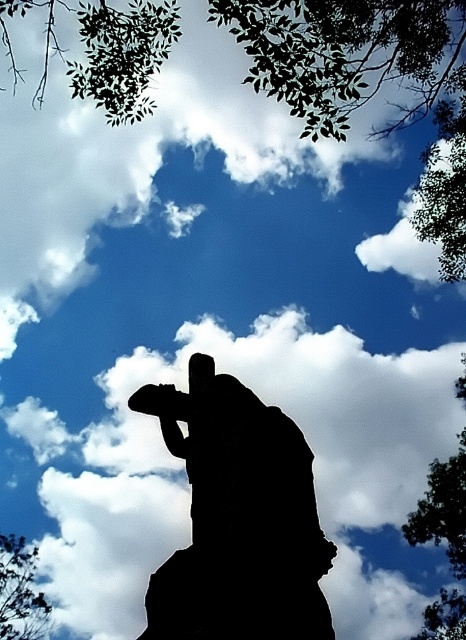
Question: Can you confirm if black silhouette skateboarder at center is wider than green leafy tree at upper left?

Choices:
 (A) no
 (B) yes

Answer: (B)

Question: Which object appears farthest from the camera in this image?

Choices:
 (A) black silhouette skateboarder at center
 (B) green leafy tree at upper left

Answer: (B)

Question: Considering the relative positions of black silhouette skateboarder at center and green leafy tree at upper left in the image provided, where is black silhouette skateboarder at center located with respect to green leafy tree at upper left?

Choices:
 (A) left
 (B) right

Answer: (B)

Question: Which of the following is the closest to the observer?

Choices:
 (A) (199, 611)
 (B) (39, 608)

Answer: (A)

Question: Does black silhouette skateboarder at center lie behind green leafy tree at upper left?

Choices:
 (A) no
 (B) yes

Answer: (A)